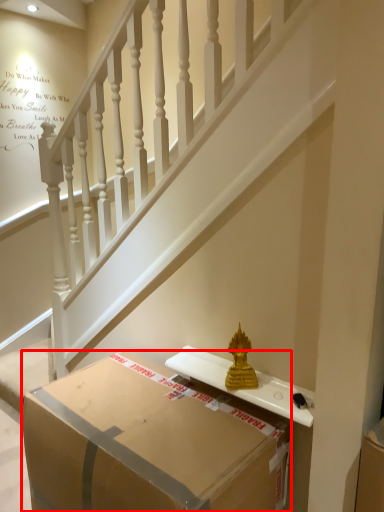
Question: From the image's perspective, what is the correct spatial relationship of box (annotated by the red box) in relation to stairs?

Choices:
 (A) above
 (B) below

Answer: (B)